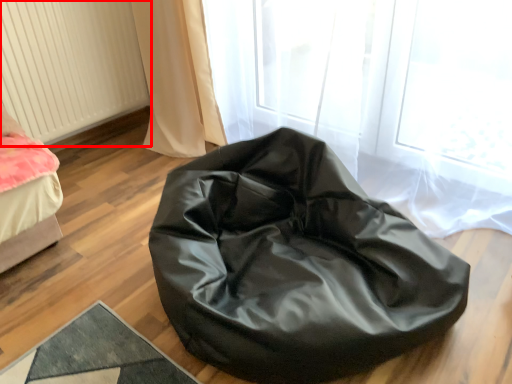
Question: From the image's perspective, considering the relative positions of radiator (annotated by the red box) and furniture in the image provided, where is radiator (annotated by the red box) located with respect to the staircase?

Choices:
 (A) above
 (B) below

Answer: (A)